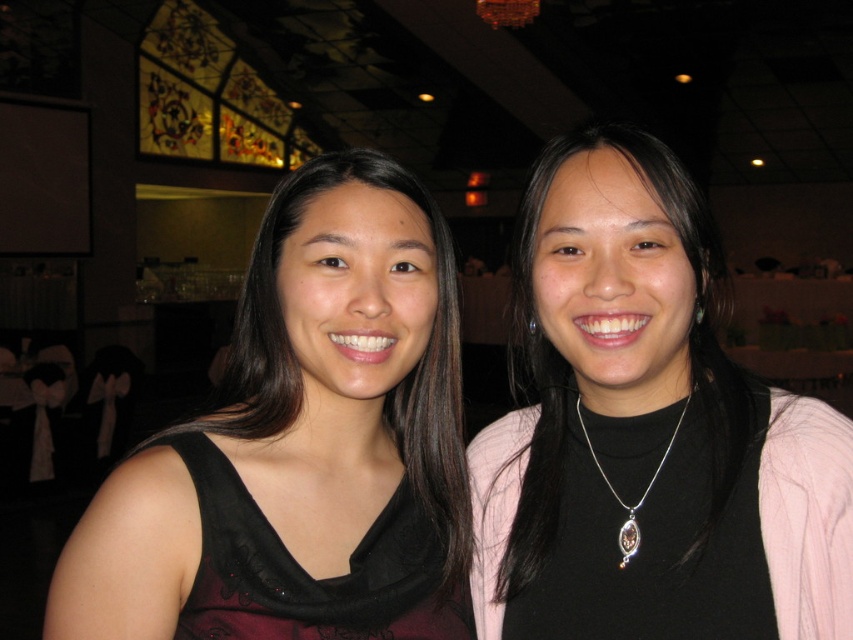
You are a photographer at a social event and want to capture a closeup of the black matte necklace at center without including the black matte dress at left in the frame. Is the necklace positioned to the right of the dress, making this possible?

The black matte necklace at center is to the right of the black matte dress at left, so yes, the necklace is positioned to the right of the dress, making it possible to capture a closeup without including the dress.